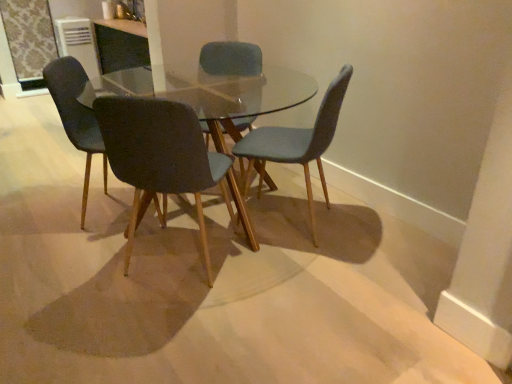
The width and height of the screenshot is (512, 384). Identify the location of matte black chair at center, marked as the 3th chair in a right-to-left arrangement. (163, 159).

The image size is (512, 384). I want to click on matte blue chair at center, the fourth chair from the left, so click(x=297, y=142).

This screenshot has height=384, width=512. I want to click on matte black chair at left, the 4th chair positioned from the right, so click(x=77, y=114).

The width and height of the screenshot is (512, 384). In order to click on matte black chair at center, marked as the 3th chair in a right-to-left arrangement in this screenshot , I will do `click(163, 159)`.

Between matte black chair at left, the 4th chair positioned from the right, and matte black chair at center, marked as the 3th chair in a right-to-left arrangement, which one appears on the left side from the viewer's perspective?

matte black chair at left, the 4th chair positioned from the right.

Is matte black chair at left, arranged as the first chair when viewed from the left, beside matte black chair at center, which is the 2th chair in left-to-right order?

No, matte black chair at left, arranged as the first chair when viewed from the left, is not beside matte black chair at center, which is the 2th chair in left-to-right order.

Is point (79, 119) positioned behind point (114, 146)?

Yes, it is behind point (114, 146).

Could you tell me if matte black chair at left, arranged as the first chair when viewed from the left, is turned towards matte black chair at center, which is the 2th chair in left-to-right order?

No, matte black chair at left, arranged as the first chair when viewed from the left, does not turn towards matte black chair at center, which is the 2th chair in left-to-right order.

Measure the distance from clear glass table at center to matte blue chair at center, marked as the first chair in a right-to-left arrangement.

The distance of clear glass table at center from matte blue chair at center, marked as the first chair in a right-to-left arrangement, is 5.18 inches.

This screenshot has width=512, height=384. There is a clear glass table at center. Find the location of `the 1st chair above it (from the image's perspective)`. the 1st chair above it (from the image's perspective) is located at coordinates (297, 142).

Considering the sizes of objects clear glass table at center and matte blue chair at center, marked as the first chair in a right-to-left arrangement, in the image provided, who is thinner, clear glass table at center or matte blue chair at center, marked as the first chair in a right-to-left arrangement,?

matte blue chair at center, marked as the first chair in a right-to-left arrangement.

Which is more to the right, clear glass table at center or matte blue chair at center, marked as the first chair in a right-to-left arrangement?

matte blue chair at center, marked as the first chair in a right-to-left arrangement.

From a real-world perspective, is matte black chair at left, arranged as the first chair when viewed from the left, positioned under matte blue chair at center, which is the second chair in right-to-left order, based on gravity?

Indeed, from a real-world perspective, matte black chair at left, arranged as the first chair when viewed from the left, is positioned beneath matte blue chair at center, which is the second chair in right-to-left order.

From the picture: Is matte black chair at left, arranged as the first chair when viewed from the left, positioned behind matte blue chair at center, which is the second chair in right-to-left order?

No, matte black chair at left, arranged as the first chair when viewed from the left, is closer to the camera.

From the picture: Between matte black chair at left, the 4th chair positioned from the right, and matte blue chair at center, which is counted as the 3th chair, starting from the left, which one has larger width?

matte black chair at left, the 4th chair positioned from the right.

Is matte blue chair at center, the fourth chair from the left, directly adjacent to clear glass table at center?

No, matte blue chair at center, the fourth chair from the left, is not making contact with clear glass table at center.

From a real-world perspective, between matte blue chair at center, marked as the first chair in a right-to-left arrangement, and clear glass table at center, who is vertically higher?

matte blue chair at center, marked as the first chair in a right-to-left arrangement, from a real-world perspective.

Does point (251, 159) come closer to viewer compared to point (62, 71)?

No, it is not.

Does matte blue chair at center, the fourth chair from the left, contain matte black chair at left, the 4th chair positioned from the right?

No, matte black chair at left, the 4th chair positioned from the right, is not a part of matte blue chair at center, the fourth chair from the left.

How many degrees apart are the facing directions of matte blue chair at center, marked as the first chair in a right-to-left arrangement, and matte black chair at left, arranged as the first chair when viewed from the left?

They differ by 161 degrees in their facing directions.

Who is taller, matte blue chair at center, the fourth chair from the left, or matte black chair at left, the 4th chair positioned from the right?

With more height is matte black chair at left, the 4th chair positioned from the right.

Is matte blue chair at center, which is the second chair in right-to-left order, directly adjacent to matte black chair at left, the 4th chair positioned from the right?

No, matte blue chair at center, which is the second chair in right-to-left order, is not touching matte black chair at left, the 4th chair positioned from the right.

Measure the distance between matte blue chair at center, which is counted as the 3th chair, starting from the left, and matte black chair at left, arranged as the first chair when viewed from the left.

They are 36.88 inches apart.

From the image's perspective, which is below, matte blue chair at center, which is the second chair in right-to-left order, or matte black chair at left, the 4th chair positioned from the right?

matte black chair at left, the 4th chair positioned from the right, is shown below in the image.

Is matte blue chair at center, which is counted as the 3th chair, starting from the left, thinner than matte black chair at left, arranged as the first chair when viewed from the left?

Yes, matte blue chair at center, which is counted as the 3th chair, starting from the left, is thinner than matte black chair at left, arranged as the first chair when viewed from the left.

Which is closer, (x=238, y=61) or (x=321, y=152)?

Point (x=238, y=61) is farther from the camera than point (x=321, y=152).

Does matte blue chair at center, which is counted as the 3th chair, starting from the left, turn towards matte blue chair at center, marked as the first chair in a right-to-left arrangement?

No, matte blue chair at center, which is counted as the 3th chair, starting from the left, is not oriented towards matte blue chair at center, marked as the first chair in a right-to-left arrangement.

From the picture: Which of these two, matte blue chair at center, which is counted as the 3th chair, starting from the left, or matte blue chair at center, the fourth chair from the left, stands shorter?

With less height is matte blue chair at center, the fourth chair from the left.

Looking at this image, what's the angular difference between matte blue chair at center, which is the second chair in right-to-left order, and matte blue chair at center, marked as the first chair in a right-to-left arrangement,'s facing directions?

The angular difference between matte blue chair at center, which is the second chair in right-to-left order, and matte blue chair at center, marked as the first chair in a right-to-left arrangement, is 92.8 degrees.

Where is `chair that appears on the left of matte black chair at center, marked as the 3th chair in a right-to-left arrangement`? The width and height of the screenshot is (512, 384). chair that appears on the left of matte black chair at center, marked as the 3th chair in a right-to-left arrangement is located at coordinates (77, 114).

Where is `chair that is the 1st one above the clear glass table at center (from a real-world perspective)`? chair that is the 1st one above the clear glass table at center (from a real-world perspective) is located at coordinates (297, 142).

Based on their spatial positions, is matte blue chair at center, marked as the first chair in a right-to-left arrangement, or matte blue chair at center, which is counted as the 3th chair, starting from the left, closer to matte black chair at center, marked as the 3th chair in a right-to-left arrangement?

Based on the image, matte blue chair at center, marked as the first chair in a right-to-left arrangement, appears to be nearer to matte black chair at center, marked as the 3th chair in a right-to-left arrangement.

Estimate the real-world distances between objects in this image. Which object is further from matte black chair at left, arranged as the first chair when viewed from the left, clear glass table at center or matte blue chair at center, the fourth chair from the left?

matte blue chair at center, the fourth chair from the left, is further to matte black chair at left, arranged as the first chair when viewed from the left.

When comparing their distances from clear glass table at center, does matte blue chair at center, which is the second chair in right-to-left order, or matte blue chair at center, the fourth chair from the left, seem closer?

matte blue chair at center, the fourth chair from the left, is positioned closer to the anchor clear glass table at center.

Estimate the real-world distances between objects in this image. Which object is further from clear glass table at center, matte black chair at left, arranged as the first chair when viewed from the left, or matte blue chair at center, the fourth chair from the left?

matte black chair at left, arranged as the first chair when viewed from the left.

Which object lies nearer to the anchor point matte blue chair at center, which is the second chair in right-to-left order, clear glass table at center or matte black chair at center, marked as the 3th chair in a right-to-left arrangement?

clear glass table at center is positioned closer to the anchor matte blue chair at center, which is the second chair in right-to-left order.

Based on their spatial positions, is matte black chair at center, which is the 2th chair in left-to-right order, or matte blue chair at center, which is the second chair in right-to-left order, closer to matte black chair at left, the 4th chair positioned from the right?

Based on the image, matte black chair at center, which is the 2th chair in left-to-right order, appears to be nearer to matte black chair at left, the 4th chair positioned from the right.

Looking at the image, which one is located further to matte black chair at center, marked as the 3th chair in a right-to-left arrangement, matte blue chair at center, which is counted as the 3th chair, starting from the left, or matte black chair at left, arranged as the first chair when viewed from the left?

matte blue chair at center, which is counted as the 3th chair, starting from the left, is further to matte black chair at center, marked as the 3th chair in a right-to-left arrangement.

Looking at the image, which one is located closer to matte black chair at left, arranged as the first chair when viewed from the left, matte blue chair at center, the fourth chair from the left, or matte blue chair at center, which is the second chair in right-to-left order?

Among the two, matte blue chair at center, which is the second chair in right-to-left order, is located nearer to matte black chair at left, arranged as the first chair when viewed from the left.

Find the location of a particular element. chair between matte black chair at left, arranged as the first chair when viewed from the left, and clear glass table at center, in the horizontal direction is located at coordinates (163, 159).

The image size is (512, 384). I want to click on kitchen & dining room table between matte black chair at center, marked as the 3th chair in a right-to-left arrangement, and matte blue chair at center, marked as the first chair in a right-to-left arrangement, from left to right, so click(243, 94).

This screenshot has height=384, width=512. Identify the location of kitchen & dining room table between matte black chair at left, the 4th chair positioned from the right, and matte blue chair at center, marked as the first chair in a right-to-left arrangement. (243, 94).

Image resolution: width=512 pixels, height=384 pixels. I want to click on kitchen & dining room table between matte black chair at center, which is the 2th chair in left-to-right order, and matte blue chair at center, which is the second chair in right-to-left order, in the front-back direction, so click(x=243, y=94).